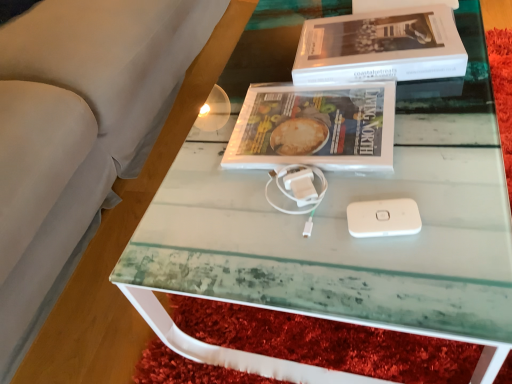
Identify the location of free location above matte plastic magazine at center (from a real-world perspective). Image resolution: width=512 pixels, height=384 pixels. (307, 115).